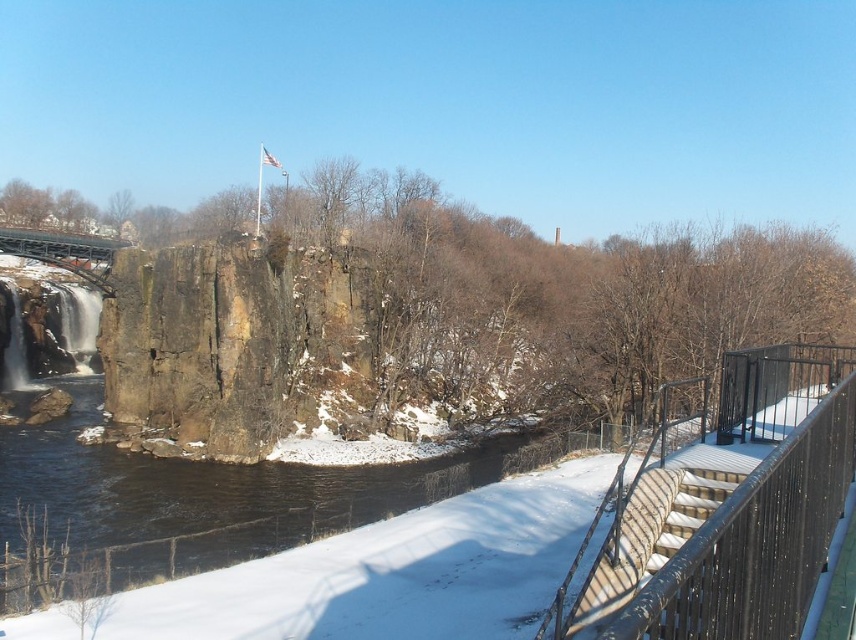
Based on the photo, is black metal railing at right above metallic gray bridge at upper left?

No.

Can you confirm if black metal railing at right is wider than metallic gray bridge at upper left?

Incorrect, black metal railing at right's width does not surpass metallic gray bridge at upper left's.

Is point (819, 401) less distant than point (111, 241)?

Yes, it is in front of point (111, 241).

Where is `black metal railing at right`? black metal railing at right is located at coordinates (721, 508).